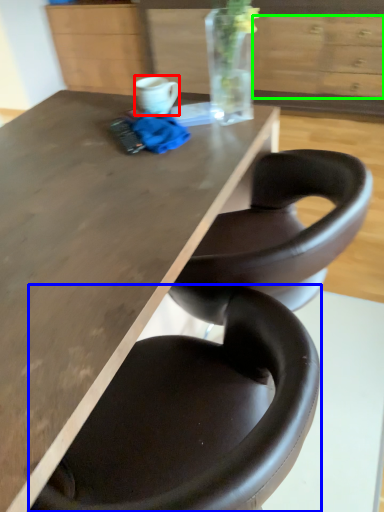
Question: Estimate the real-world distances between objects in this image. Which object is farther from mug (highlighted by a red box), chair (highlighted by a blue box) or drawer (highlighted by a green box)?

Choices:
 (A) chair
 (B) drawer

Answer: (B)